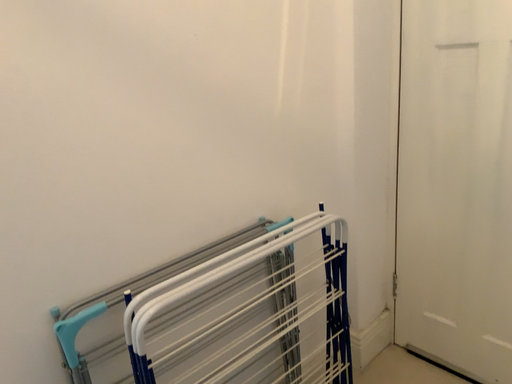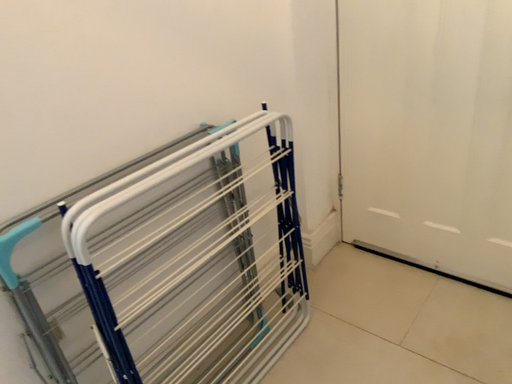
Question: How did the camera likely rotate when shooting the video?

Choices:
 (A) rotated upward
 (B) rotated downward

Answer: (B)